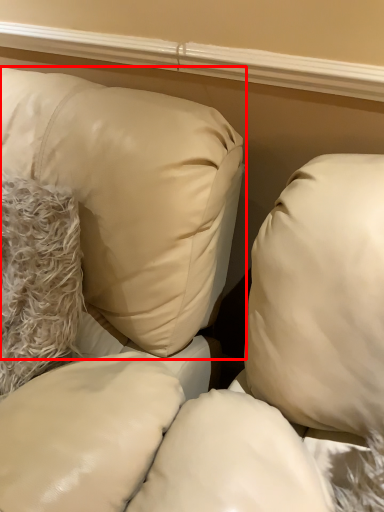
Question: From the image's perspective, considering the relative positions of pillow (annotated by the red box) and pillow in the image provided, where is pillow (annotated by the red box) located with respect to the staircase?

Choices:
 (A) below
 (B) above

Answer: (A)